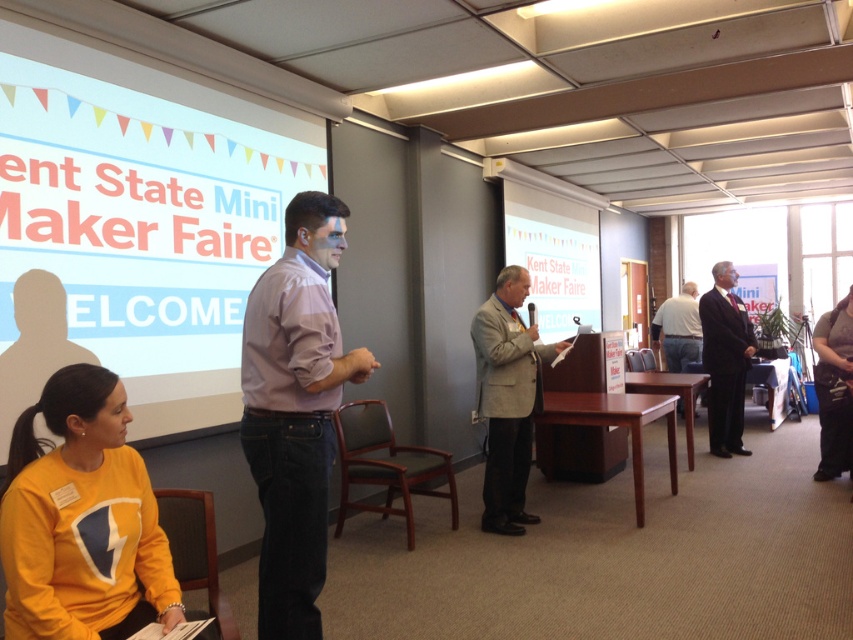
You are setting up a video conference call in the room. The camera needs to be placed exactly 20 feet away from the white matte projection screen at center to ensure optimal focus. Is the current placement of the camera within the required distance?

The camera is currently 21.45 feet away from the white matte projection screen at center, which is slightly beyond the 20 feet requirement. To achieve optimal focus, the camera should be moved closer by approximately 1.45 feet.

You are organizing a presentation and need to ensure that the white cotton shirt at center does not block the white matte projection screen at center during the talk. Based on their sizes, which object is taller and therefore more likely to be visible from the back of the room?

The white matte projection screen at center is taller than the white cotton shirt at center, so it will be more visible from the back of the room.

You are standing in the conference room and need to move from the point at coordinates point [270,234] to the point at coordinates point [738,428]. Is the destination point behind or in front of your starting position?

The point at coordinates point [738,428] is behind the point at coordinates point [270,234], so the destination point is behind your starting position.